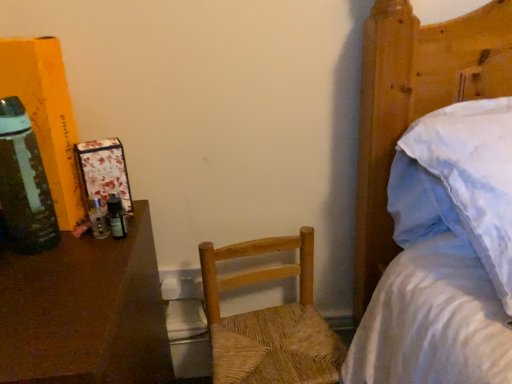
At what (x,y) coordinates should I click in order to perform the action: click on vacant area located to the right-hand side of green glass bottle at left. Please return your answer as a coordinate pair (x, y). Looking at the image, I should click on (95, 256).